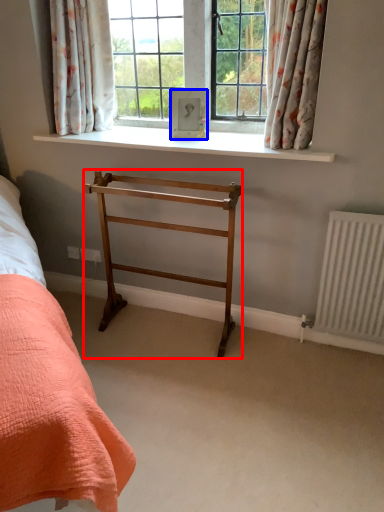
Question: Which object appears closest to the camera in this image, furniture (highlighted by a red box) or picture frame (highlighted by a blue box)?

Choices:
 (A) furniture
 (B) picture frame

Answer: (A)